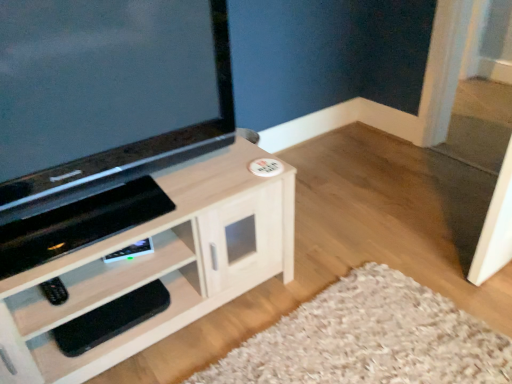
At what (x,y) coordinates should I click in order to perform the action: click on free space above light wood cabinet at center (from a real-world perspective). Please return your answer as a coordinate pair (x, y). The width and height of the screenshot is (512, 384). Looking at the image, I should click on (138, 200).